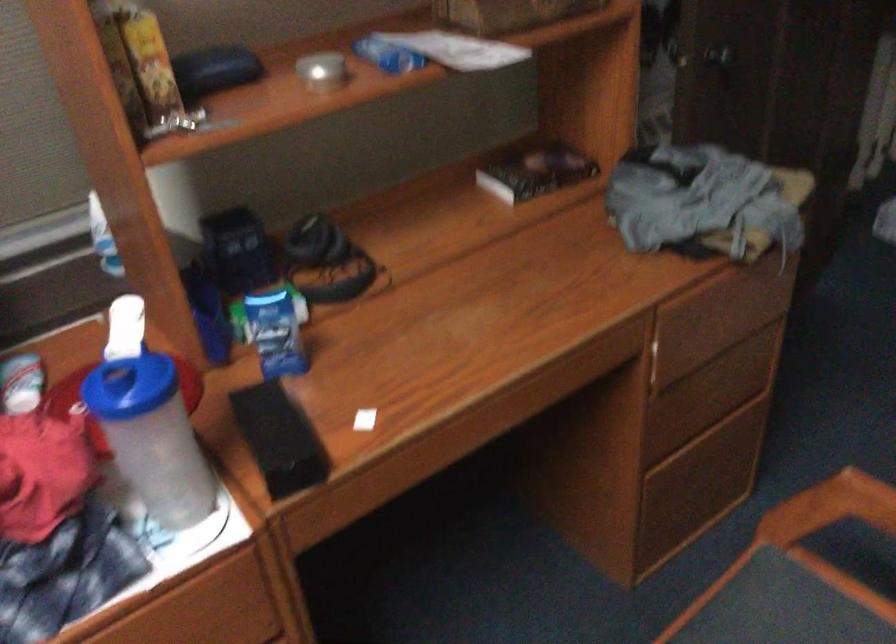
Where would you twist the blue bottle lid? Please return your answer as a coordinate pair (x, y).

(130, 386)